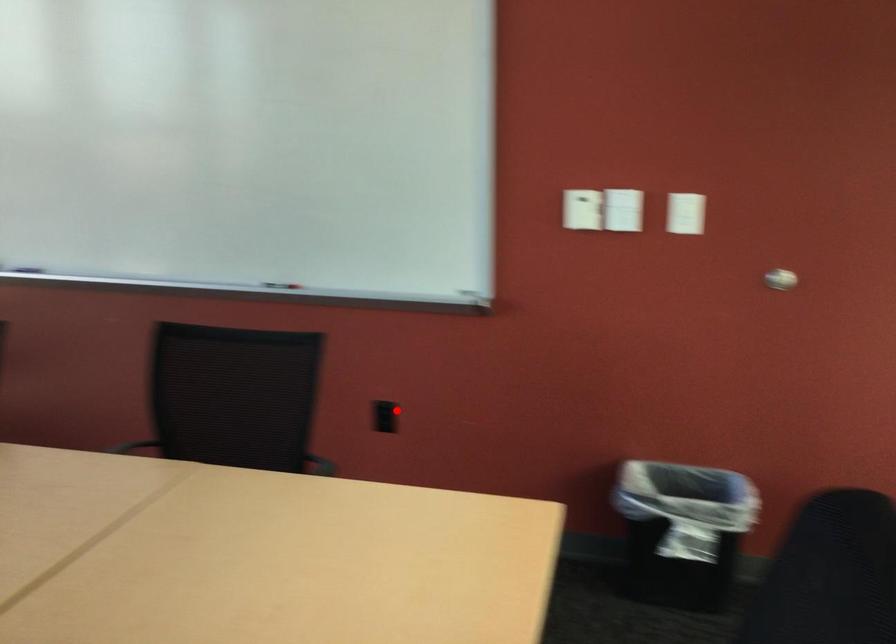
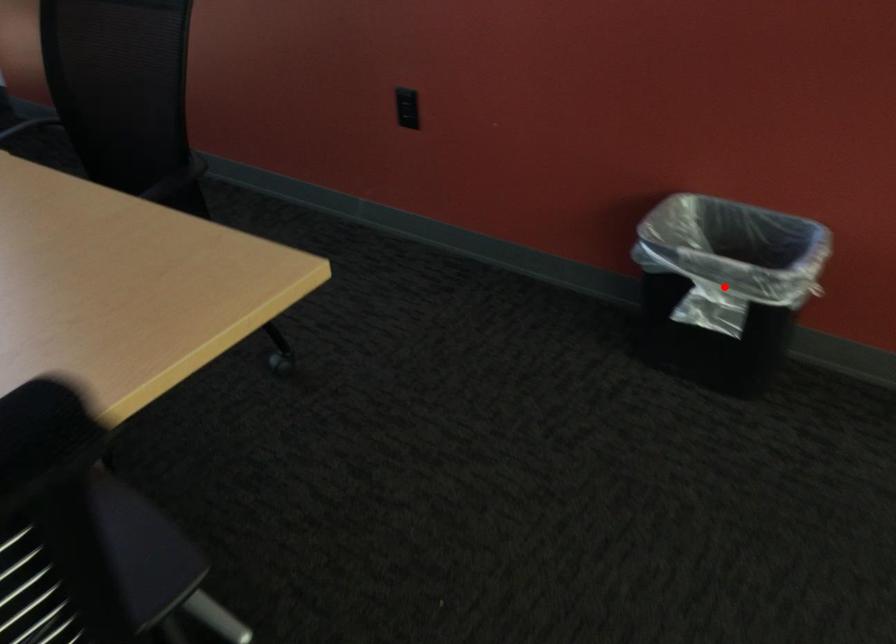
I am providing you with two images of the same scene from different viewpoints. A red point is marked on the first image and another point is marked on the second image. Is the red point in image1 aligned with the point shown in image2?

No